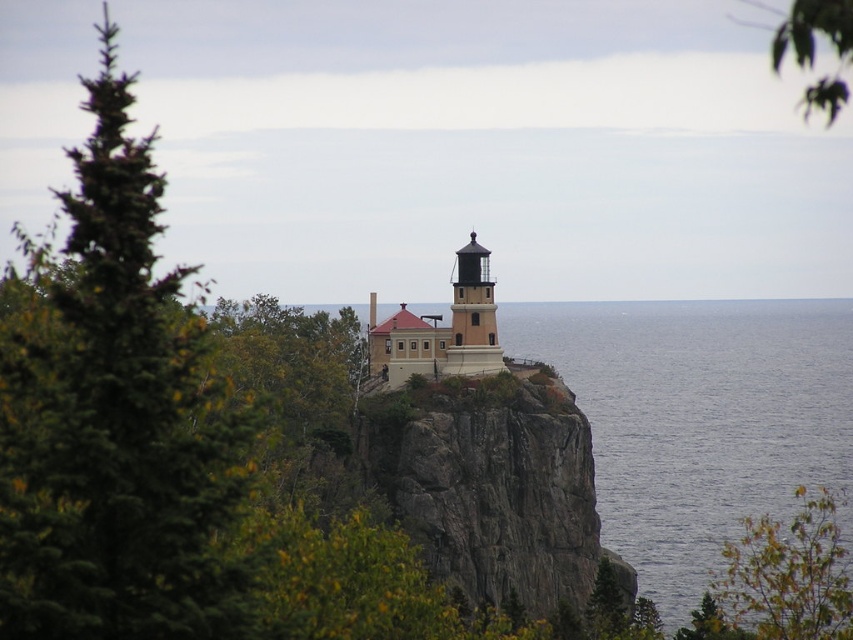
Can you confirm if blue water at cliff edge is positioned to the left of green leafy tree at lower right?

Yes, blue water at cliff edge is to the left of green leafy tree at lower right.

Does point (727, 321) lie behind point (726, 580)?

Yes.

Identify the location of blue water at cliff edge. The image size is (853, 640). (698, 419).

Between green needle-like tree at left and matte black lighthouse at center, which one is positioned lower?

matte black lighthouse at center is below.

Is green needle-like tree at left below matte black lighthouse at center?

Incorrect, green needle-like tree at left is not positioned below matte black lighthouse at center.

Describe the element at coordinates (117, 422) in the screenshot. I see `green needle-like tree at left` at that location.

Identify the location of green needle-like tree at left. (117, 422).

Does green leafy tree at lower right have a greater height compared to matte black lighthouse at center?

Yes.

Which is more to the left, green leafy tree at lower right or matte black lighthouse at center?

matte black lighthouse at center is more to the left.

Which is behind, point (834, 509) or point (451, 355)?

Point (834, 509)

Where is `green leafy tree at lower right`? This screenshot has height=640, width=853. green leafy tree at lower right is located at coordinates (780, 579).